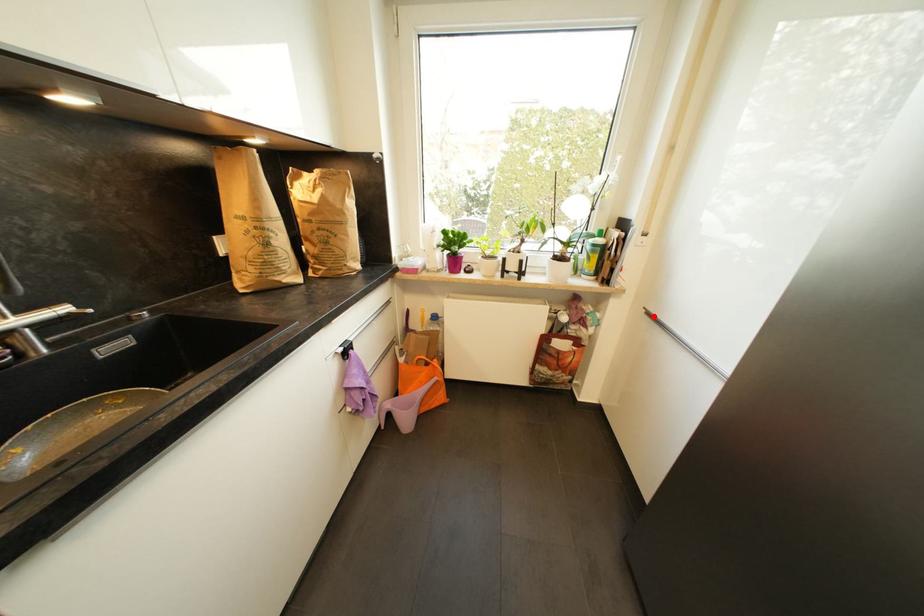
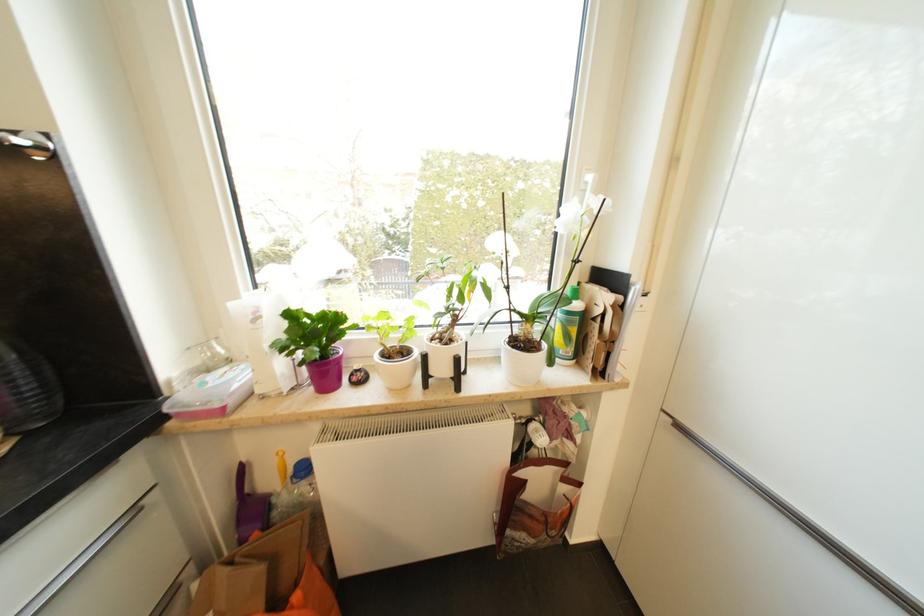
Question: A red point is marked in image1. In image2, is the corresponding 3D point closer to the camera or farther? Reply with the corresponding letter.

Choices:
 (A) The corresponding 3D point is closer.
 (B) The corresponding 3D point is farther.

Answer: (B)